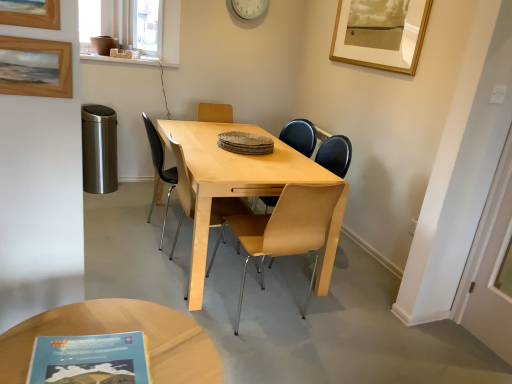
Question: Is white plastic clock at upper center outside of light brown leather chair at center, the 2th chair from the back?

Choices:
 (A) no
 (B) yes

Answer: (B)

Question: From the image's perspective, is white plastic clock at upper center above light brown leather chair at center, marked as the first chair in a front-to-back arrangement?

Choices:
 (A) yes
 (B) no

Answer: (A)

Question: Does white plastic clock at upper center have a larger size compared to light brown leather chair at center, the 2th chair from the back?

Choices:
 (A) no
 (B) yes

Answer: (A)

Question: Is white plastic clock at upper center facing towards light brown leather chair at center, the 2th chair from the back?

Choices:
 (A) yes
 (B) no

Answer: (B)

Question: Is white plastic clock at upper center shorter than light brown leather chair at center, the 2th chair from the back?

Choices:
 (A) yes
 (B) no

Answer: (A)

Question: Considering their positions, is white plastic clock at upper center located in front of or behind transparent plastic window screen at upper left?

Choices:
 (A) front
 (B) behind

Answer: (B)

Question: In terms of size, does white plastic clock at upper center appear bigger or smaller than transparent plastic window screen at upper left?

Choices:
 (A) small
 (B) big

Answer: (A)

Question: From a real-world perspective, relative to transparent plastic window screen at upper left, is white plastic clock at upper center vertically above or below?

Choices:
 (A) below
 (B) above

Answer: (B)

Question: Considering the positions of white plastic clock at upper center and transparent plastic window screen at upper left in the image, is white plastic clock at upper center wider or thinner than transparent plastic window screen at upper left?

Choices:
 (A) wide
 (B) thin

Answer: (B)

Question: Is wooden picture frame at upper left, the 2th picture frame from the top, to the left or to the right of white plastic clock at upper center in the image?

Choices:
 (A) right
 (B) left

Answer: (B)

Question: Considering their positions, is wooden picture frame at upper left, marked as the 2th picture frame in a left-to-right arrangement, located in front of or behind white plastic clock at upper center?

Choices:
 (A) behind
 (B) front

Answer: (B)

Question: Is wooden picture frame at upper left, arranged as the 2th picture frame when viewed from the right, inside the boundaries of white plastic clock at upper center, or outside?

Choices:
 (A) outside
 (B) inside

Answer: (A)

Question: Is wooden picture frame at upper left, placed as the first picture frame when sorted from front to back, wider or thinner than white plastic clock at upper center?

Choices:
 (A) wide
 (B) thin

Answer: (B)

Question: Considering the positions of light brown wood chair at center, placed as the second chair when sorted from front to back, and wooden picture frame at upper left, placed as the first picture frame when sorted from front to back, in the image, is light brown wood chair at center, placed as the second chair when sorted from front to back, bigger or smaller than wooden picture frame at upper left, placed as the first picture frame when sorted from front to back,?

Choices:
 (A) big
 (B) small

Answer: (A)

Question: From the image's perspective, relative to wooden picture frame at upper left, the 2th picture frame ordered from the bottom, is light brown wood chair at center, the first chair when ordered from back to front, above or below?

Choices:
 (A) below
 (B) above

Answer: (A)